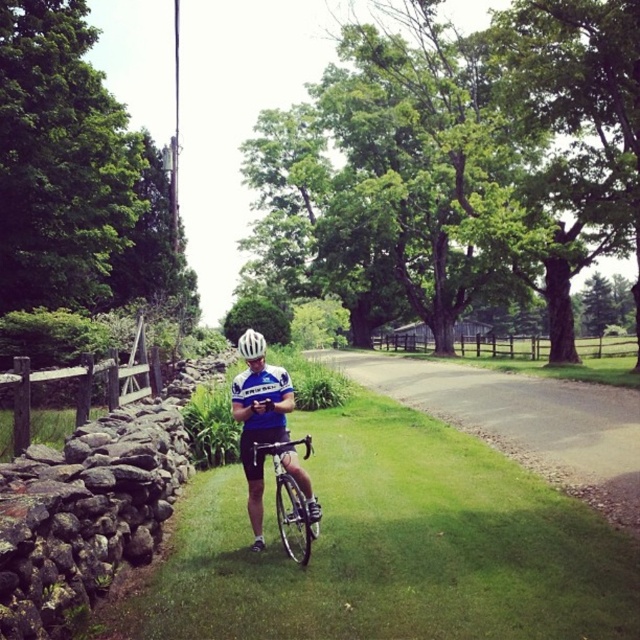
You are a drone operator trying to capture a photo of the cyclist. You have two points marked in the scene for focus adjustments. The first point is at coordinates point (253, 531) and the second is at point (244, 332). Which point should you focus on to ensure the cyclist is in focus, considering depth of field?

Point (253, 531) is closer to the viewer than point (244, 332). To ensure the cyclist is in focus, focus on the point closer to the viewer, which is point (253, 531).

You are a photographer who needs to take a photo of the cyclist wearing the blue jersey at center. You have a camera that requires a minimum distance of 10 feet to focus properly. Can you position yourself at the camera to capture the cyclist clearly?

The blue jersey at center and camera are 12.03 feet apart from each other, which is more than the required 10 feet. Therefore, you can position yourself at the camera to capture the cyclist wearing the blue jersey at center clearly.